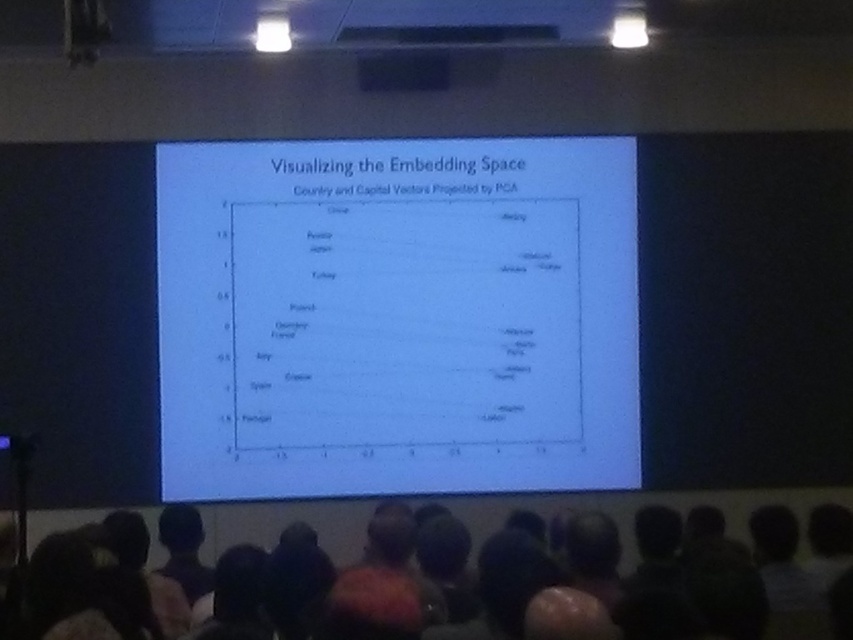
You are standing in the lecture hall and want to read the white paper at center. Can you reach it without moving?

The white paper at center is 5.57 meters away from you, so you cannot reach it without moving closer.

You are an attendee at the presentation and want to take notes on the slide. The white paper at center and the black matte rectangle at upper center are both on the slide. Which object has a greater width?

The white paper at center has a greater width than the black matte rectangle at upper center according to the description.